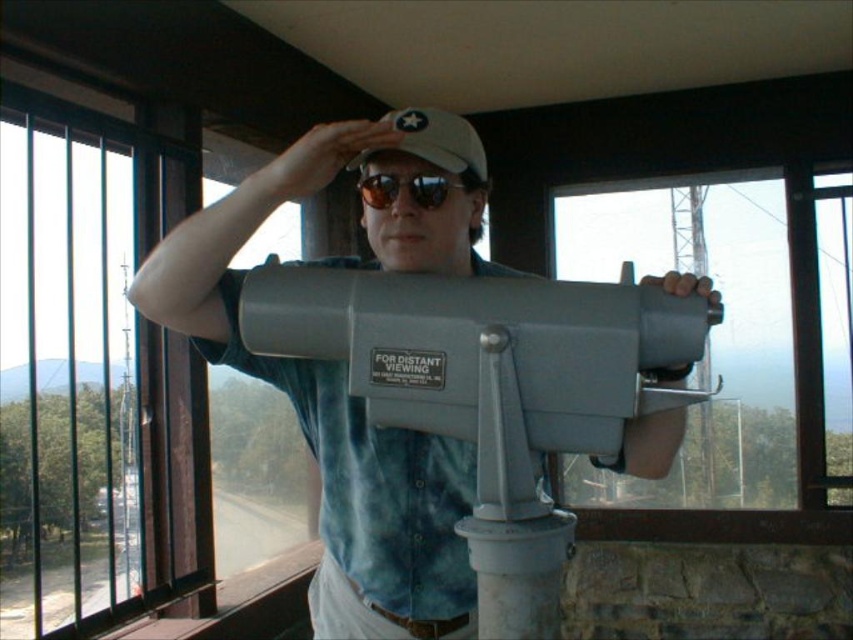
What do you see at coordinates (91, 369) in the screenshot? The height and width of the screenshot is (640, 853). I see `clear glass window at left` at bounding box center [91, 369].

Can you confirm if clear glass window at left is positioned below sunglasses at center?

Correct, clear glass window at left is located below sunglasses at center.

Which is in front, point (3, 365) or point (378, 179)?

Point (378, 179) is more forward.

Locate an element on the screen. The height and width of the screenshot is (640, 853). clear glass window at left is located at coordinates (91, 369).

Is matte gray telescope at center shorter than white matte baseball hat at center?

No, matte gray telescope at center is not shorter than white matte baseball hat at center.

Is matte gray telescope at center bigger than white matte baseball hat at center?

Yes, matte gray telescope at center is bigger than white matte baseball hat at center.

Is point (339, 630) closer to viewer compared to point (430, 109)?

That is False.

The image size is (853, 640). Find the location of `matte gray telescope at center`. matte gray telescope at center is located at coordinates (332, 410).

Does point (22, 324) come in front of point (477, 138)?

No, (22, 324) is further to viewer.

Can you confirm if clear glass window at left is smaller than white matte baseball hat at center?

No, clear glass window at left is not smaller than white matte baseball hat at center.

Which is in front, point (18, 436) or point (451, 115)?

Point (451, 115) is in front.

This screenshot has height=640, width=853. I want to click on clear glass window at left, so click(91, 369).